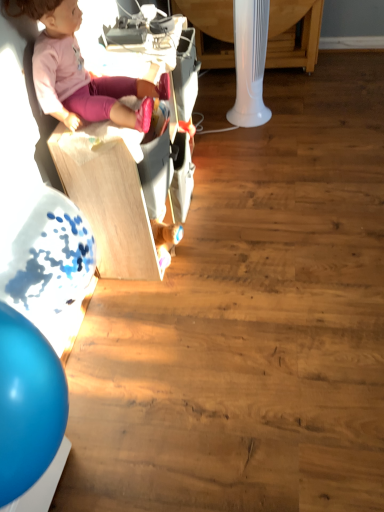
Question: In terms of width, does wooden toy box at upper left look wider or thinner when compared to pink fabric doll at upper left?

Choices:
 (A) wide
 (B) thin

Answer: (B)

Question: Based on their sizes in the image, would you say wooden toy box at upper left is bigger or smaller than pink fabric doll at upper left?

Choices:
 (A) small
 (B) big

Answer: (B)

Question: Which object is the closest to the pink fabric doll at upper left?

Choices:
 (A) wooden toy box at upper left
 (B) white plastic table at upper center

Answer: (A)

Question: Estimate the real-world distances between objects in this image. Which object is farther from the white plastic table at upper center?

Choices:
 (A) wooden toy box at upper left
 (B) pink fabric doll at upper left

Answer: (B)